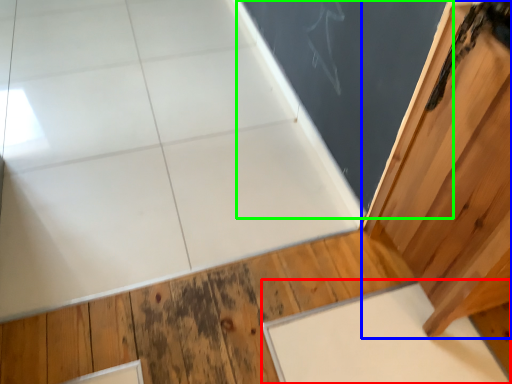
Question: Which object is positioned closest to slate (highlighted by a red box)? Select from door (highlighted by a blue box) and bulletin board (highlighted by a green box).

Choices:
 (A) door
 (B) bulletin board

Answer: (A)